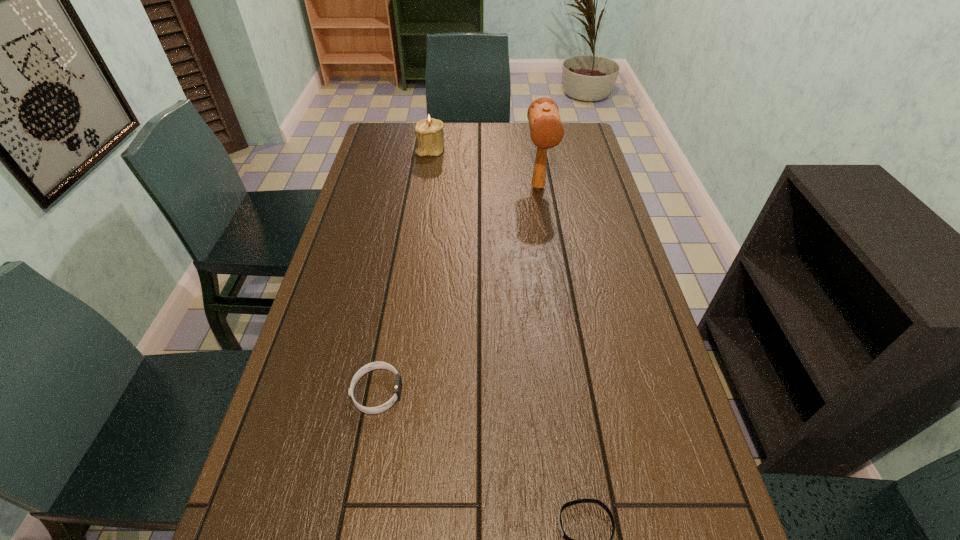
In order to click on free space between the left wristband and the candle_holder in this screenshot , I will do `click(404, 271)`.

Point out which object is positioned as the third nearest to the candle_holder. Please provide its 2D coordinates. Your answer should be formatted as a tuple, i.e. [(x, y)], where the tuple contains the x and y coordinates of a point satisfying the conditions above.

[(559, 521)]

Select which object is the second closest to the farther wristband. Please provide its 2D coordinates. Your answer should be formatted as a tuple, i.e. [(x, y)], where the tuple contains the x and y coordinates of a point satisfying the conditions above.

[(546, 130)]

Where is `free point that satisfies the following two spatial constraints: 1. on the strike surface of the third nearest object; 2. on the outer surface of the left wristband`? Image resolution: width=960 pixels, height=540 pixels. free point that satisfies the following two spatial constraints: 1. on the strike surface of the third nearest object; 2. on the outer surface of the left wristband is located at coordinates (570, 392).

This screenshot has height=540, width=960. Find the location of `free spot that satisfies the following two spatial constraints: 1. on the front side of the second tallest object; 2. on the outer surface of the left wristband`. free spot that satisfies the following two spatial constraints: 1. on the front side of the second tallest object; 2. on the outer surface of the left wristband is located at coordinates (395, 392).

Find the location of a particular element. vacant space that satisfies the following two spatial constraints: 1. on the strike surface of the tallest object; 2. on the outer surface of the taller wristband is located at coordinates (570, 392).